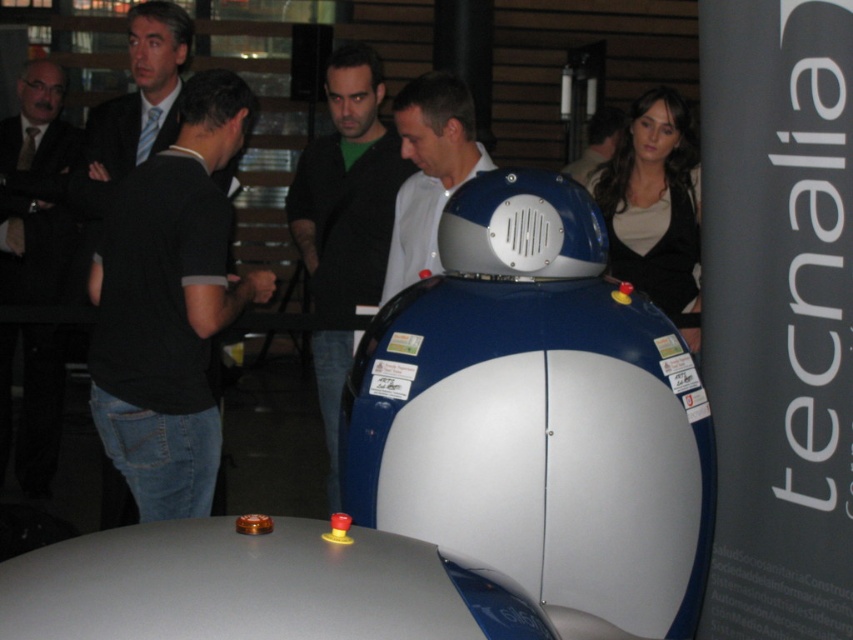
You are at a technology event and see two people wearing shirts. One is wearing a black cotton shirt at left and the other a dark blue shirt at upper center. Which person takes up less visual space in the image?

The black cotton shirt at left occupies less space than the dark blue shirt at upper center, so the person wearing the black cotton shirt at left takes up less visual space.

You are at a robotics event and notice two people wearing shirts. One is wearing a black cotton shirt at left and the other a dark green shirt at center. From your perspective, which shirt is positioned lower in the image?

The black cotton shirt at left is positioned below the dark green shirt at center, so the black cotton shirt at left is lower in the image.

You are at a robotics event and see two people wearing a black cotton shirt at left and a dark green shirt at center. Which person is wearing a smaller shirt?

The black cotton shirt at left is smaller than the dark green shirt at center.